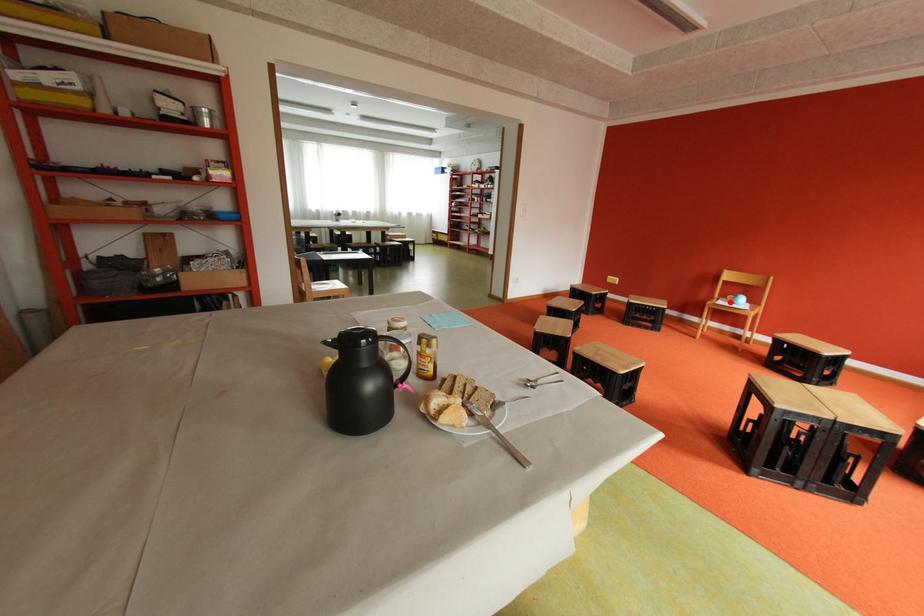
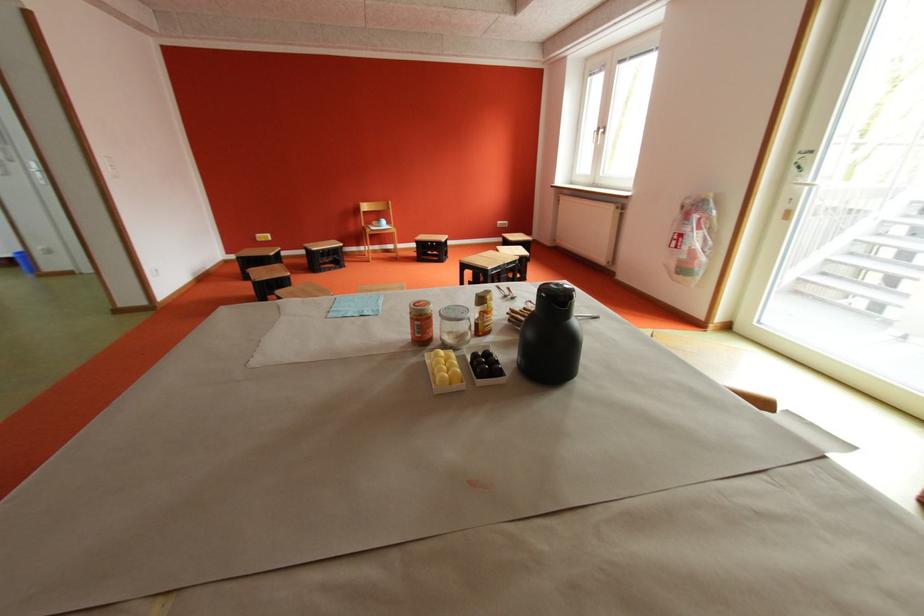
Find the pixel in the second image that matches the highlighted location in the first image.

(383, 229)